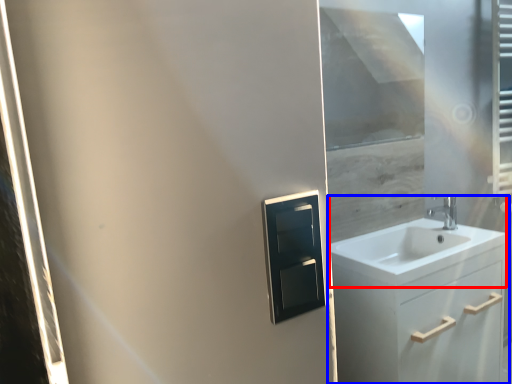
Question: Among these objects, which one is nearest to the camera, sink (highlighted by a red box) or bathroom cabinet (highlighted by a blue box)?

Choices:
 (A) sink
 (B) bathroom cabinet

Answer: (B)